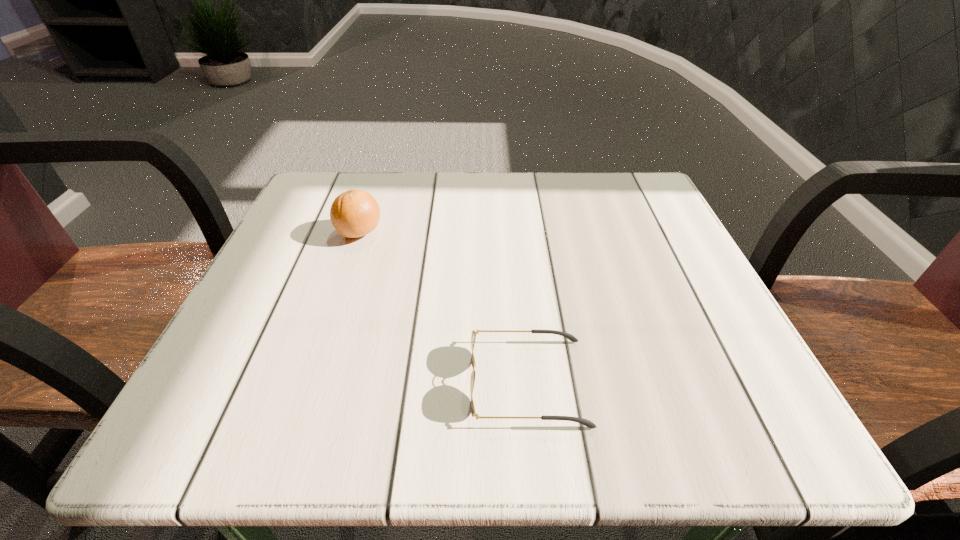
Identify the location of the taller object. The width and height of the screenshot is (960, 540). (354, 213).

Image resolution: width=960 pixels, height=540 pixels. Find the location of `orange`. orange is located at coordinates (354, 213).

I want to click on the right object, so [x=587, y=423].

Where is `the shorter object`? the shorter object is located at coordinates (587, 423).

Identify the location of free space located 0.140m on the back of the orange. This screenshot has width=960, height=540. (375, 185).

The image size is (960, 540). I want to click on free space located on the front-facing side of the sunglasses, so click(x=196, y=382).

Where is `free location located on the front-facing side of the sunglasses`? This screenshot has width=960, height=540. free location located on the front-facing side of the sunglasses is located at coordinates (231, 382).

This screenshot has height=540, width=960. What are the coordinates of `free spot located on the front-facing side of the sunglasses` in the screenshot? It's located at (245, 382).

The width and height of the screenshot is (960, 540). I want to click on object that is at the far edge, so (x=354, y=213).

Locate an element on the screen. This screenshot has width=960, height=540. object present at the near edge is located at coordinates (587, 423).